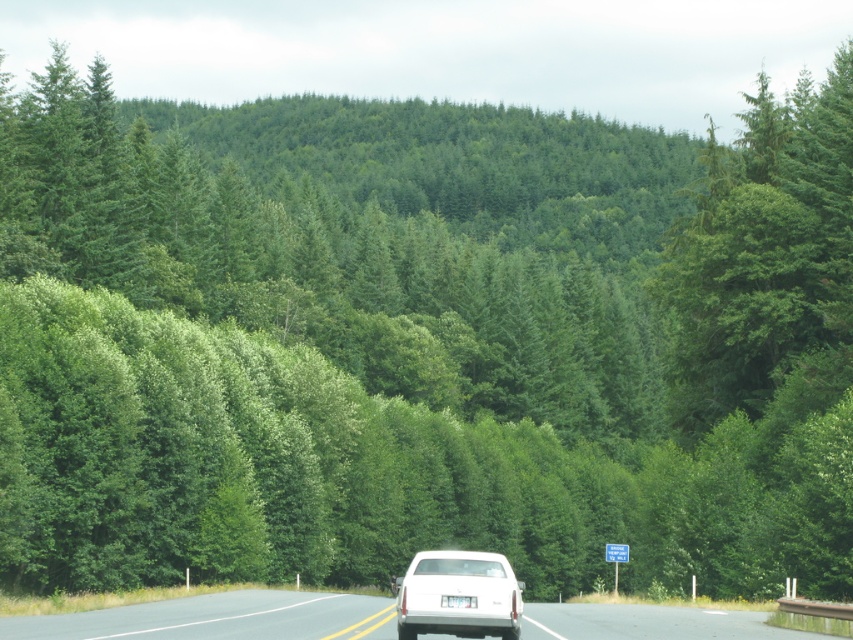
Question: Does white glossy truck at center have a larger size compared to white glossy car at center?

Choices:
 (A) no
 (B) yes

Answer: (B)

Question: Is white glossy truck at center thinner than white glossy car at center?

Choices:
 (A) no
 (B) yes

Answer: (A)

Question: Does white glossy truck at center appear on the right side of white glossy car at center?

Choices:
 (A) no
 (B) yes

Answer: (A)

Question: Which point appears farthest from the camera in this image?

Choices:
 (A) (730, 634)
 (B) (410, 620)

Answer: (A)